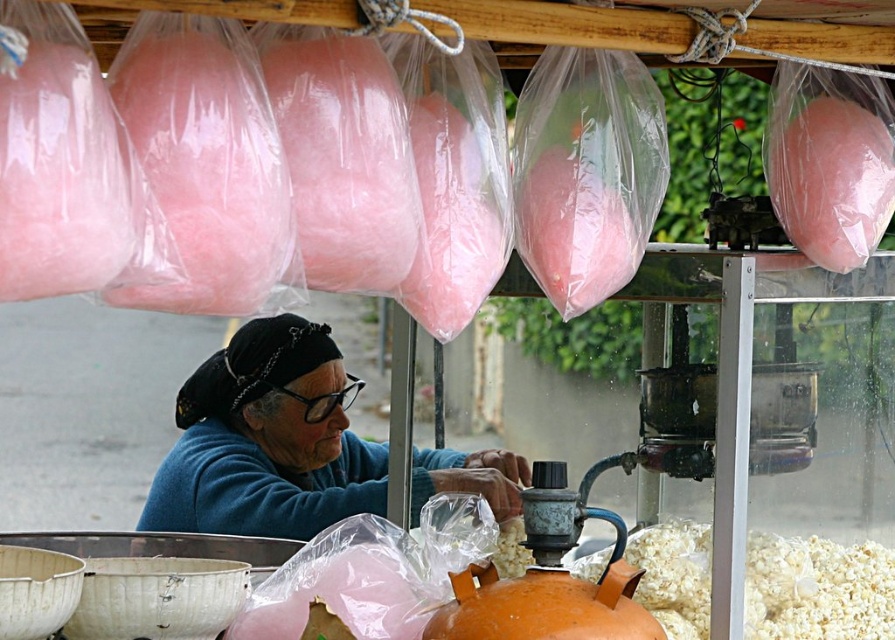
Question: Does white fluffy popcorn at lower right appear over pink cotton candy at upper right?

Choices:
 (A) yes
 (B) no

Answer: (B)

Question: Which of the following is the closest to the observer?

Choices:
 (A) (266, 365)
 (B) (703, 536)
 (C) (837, 216)

Answer: (C)

Question: Which point appears closest to the camera in this image?

Choices:
 (A) (853, 150)
 (B) (699, 636)

Answer: (A)

Question: Which point is closer to the camera?

Choices:
 (A) pink cotton candy at upper right
 (B) blue fabric at center

Answer: (A)

Question: Does white fluffy popcorn at lower right have a greater width compared to pink cotton candy at upper right?

Choices:
 (A) no
 (B) yes

Answer: (B)

Question: Is blue fabric at center to the left of white fluffy popcorn at lower right from the viewer's perspective?

Choices:
 (A) no
 (B) yes

Answer: (B)